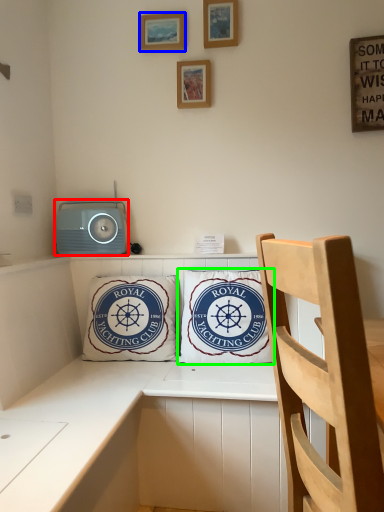
Question: Which object is positioned farthest from stereo (highlighted by a red box)? Select from picture frame (highlighted by a blue box) and pillow (highlighted by a green box).

Choices:
 (A) picture frame
 (B) pillow

Answer: (A)